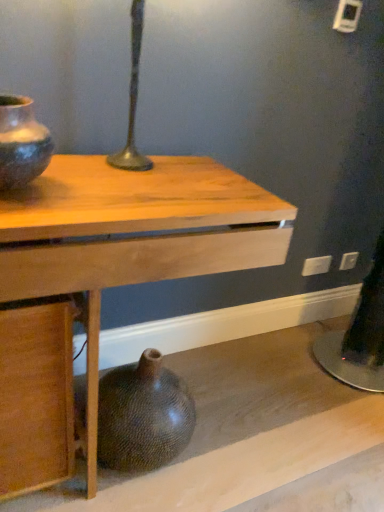
Question: From the image's perspective, is white plastic electric outlet at lower right, which appears as the second electric outlet when viewed from the front, above or below white plastic electric outlet at lower right, the 2th electric outlet in the right-to-left sequence?

Choices:
 (A) above
 (B) below

Answer: (A)

Question: In terms of height, does white plastic electric outlet at lower right, which appears as the 2th electric outlet when viewed from the left, look taller or shorter compared to white plastic electric outlet at lower right, which appears as the 2th electric outlet when viewed from the back?

Choices:
 (A) tall
 (B) short

Answer: (B)

Question: Estimate the real-world distances between objects in this image. Which object is farther from the wooden table at center?

Choices:
 (A) white plastic electric outlet at lower right, which appears as the second electric outlet when viewed from the front
 (B) brown textured vase at lower center, the second vase from the top
 (C) matte black vase at left, marked as the second vase in a back-to-front arrangement
 (D) white plastic electric outlet at lower right, which is counted as the first electric outlet, starting from the front

Answer: (A)

Question: Considering the real-world distances, which object is farthest from the brown textured vase at lower center, the 2th vase from the front?

Choices:
 (A) white plastic electric outlet at lower right, which appears as the second electric outlet when viewed from the front
 (B) wooden table at center
 (C) white plastic electric outlet at lower right, the 2th electric outlet in the right-to-left sequence
 (D) matte black vase at left, which is counted as the 2th vase, starting from the bottom

Answer: (A)